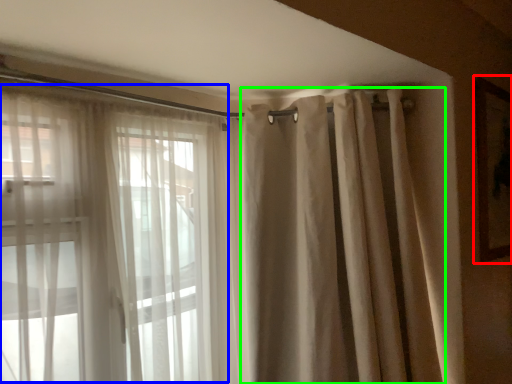
Question: Which is farther away from picture frame (highlighted by a red box)? bay window (highlighted by a blue box) or shower curtain (highlighted by a green box)?

Choices:
 (A) bay window
 (B) shower curtain

Answer: (A)